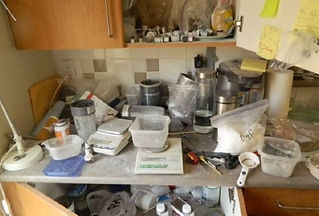
I want to click on countertop, so click(x=115, y=165).